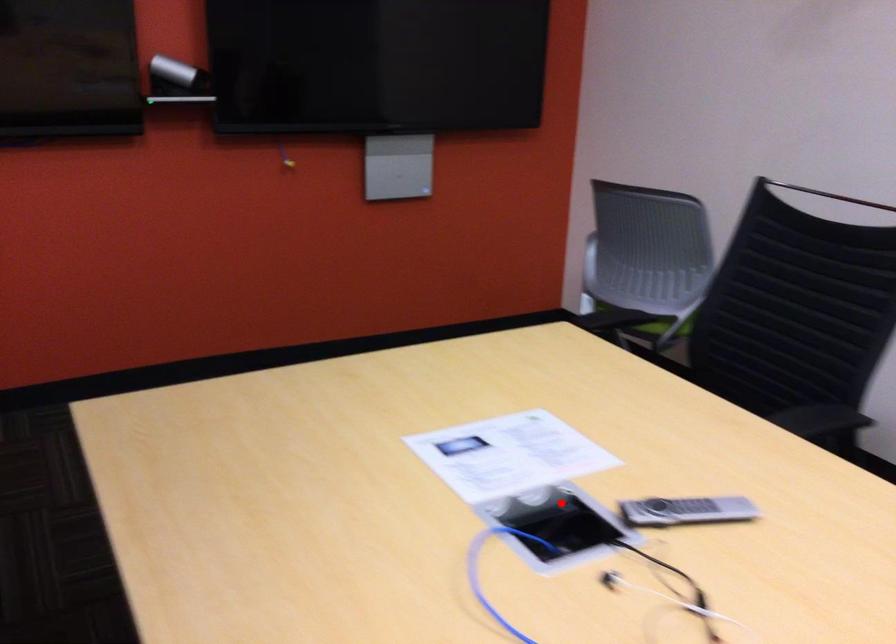
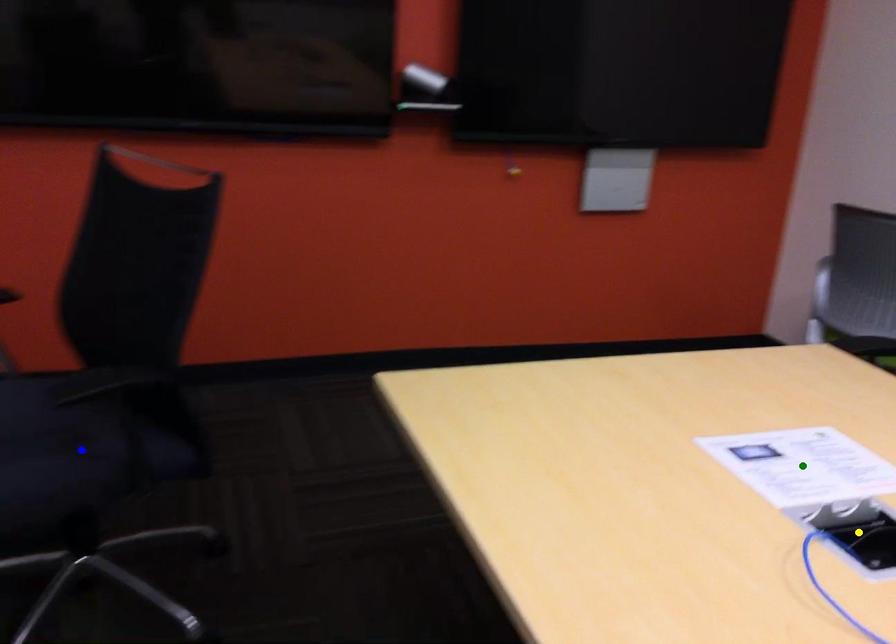
Question: I am providing you with two images of the same scene from different viewpoints. A red point is marked on the first image. You are given multiple points on the second image. Which mark in image 2 goes with the point in image 1?

Choices:
 (A) green point
 (B) yellow point
 (C) blue point

Answer: (B)